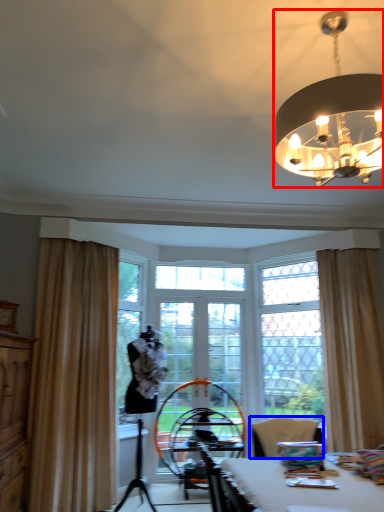
Question: Which object appears closest to the camera in this image, lamp (highlighted by a red box) or chair (highlighted by a blue box)?

Choices:
 (A) lamp
 (B) chair

Answer: (A)